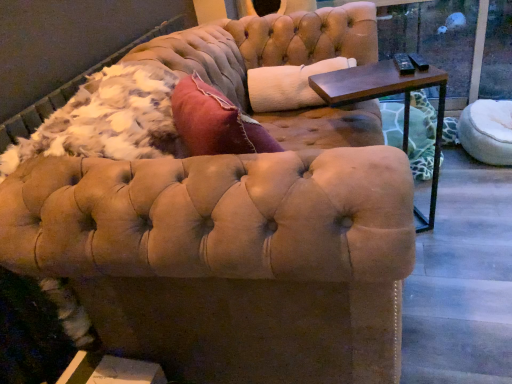
Question: Considering the relative sizes of transparent glass window screen at upper right and white fluffy pet bed at right in the image provided, is transparent glass window screen at upper right wider than white fluffy pet bed at right?

Choices:
 (A) yes
 (B) no

Answer: (B)

Question: Is transparent glass window screen at upper right further to the viewer compared to white fluffy pet bed at right?

Choices:
 (A) yes
 (B) no

Answer: (A)

Question: Is transparent glass window screen at upper right far away from white fluffy pet bed at right?

Choices:
 (A) no
 (B) yes

Answer: (A)

Question: From the image's perspective, would you say transparent glass window screen at upper right is shown under white fluffy pet bed at right?

Choices:
 (A) yes
 (B) no

Answer: (B)

Question: Is transparent glass window screen at upper right positioned in front of white fluffy pet bed at right?

Choices:
 (A) no
 (B) yes

Answer: (A)

Question: From a real-world perspective, relative to dark brown wood side table at upper right, is transparent glass window screen at upper right vertically above or below?

Choices:
 (A) below
 (B) above

Answer: (B)

Question: In terms of size, does transparent glass window screen at upper right appear bigger or smaller than dark brown wood side table at upper right?

Choices:
 (A) big
 (B) small

Answer: (B)

Question: From the image's perspective, is transparent glass window screen at upper right located above or below dark brown wood side table at upper right?

Choices:
 (A) below
 (B) above

Answer: (B)

Question: Do you think transparent glass window screen at upper right is within dark brown wood side table at upper right, or outside of it?

Choices:
 (A) outside
 (B) inside

Answer: (A)

Question: Is white fluffy pet bed at right inside or outside of dark brown wood side table at upper right?

Choices:
 (A) outside
 (B) inside

Answer: (A)

Question: Is white fluffy pet bed at right bigger or smaller than dark brown wood side table at upper right?

Choices:
 (A) small
 (B) big

Answer: (A)

Question: Does point (503, 104) appear closer or farther from the camera than point (422, 59)?

Choices:
 (A) farther
 (B) closer

Answer: (B)

Question: Is white fluffy pet bed at right wider or thinner than dark brown wood side table at upper right?

Choices:
 (A) thin
 (B) wide

Answer: (B)

Question: Based on their positions, is white fluffy pet bed at right located to the left or right of transparent glass window screen at upper right?

Choices:
 (A) left
 (B) right

Answer: (B)

Question: Is white fluffy pet bed at right inside or outside of transparent glass window screen at upper right?

Choices:
 (A) inside
 (B) outside

Answer: (B)